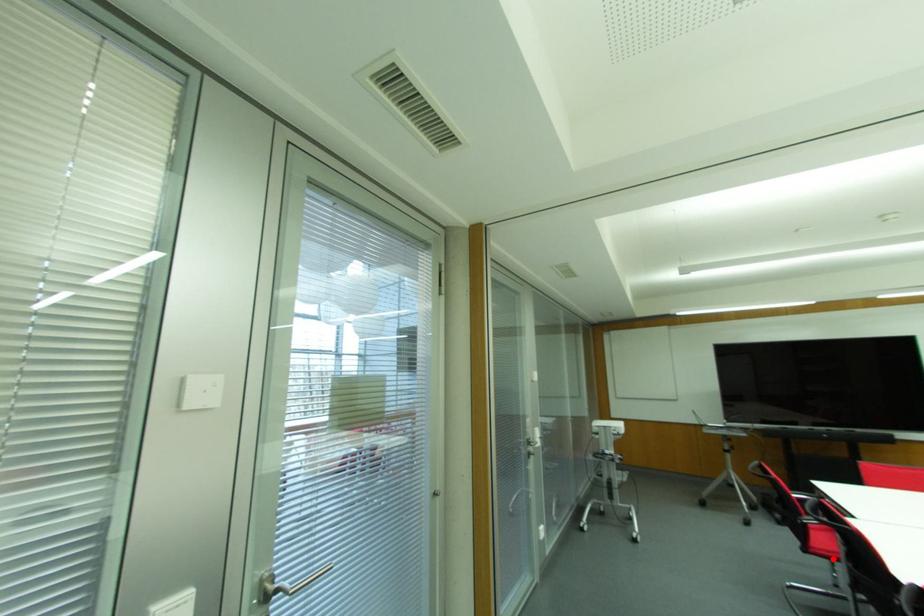
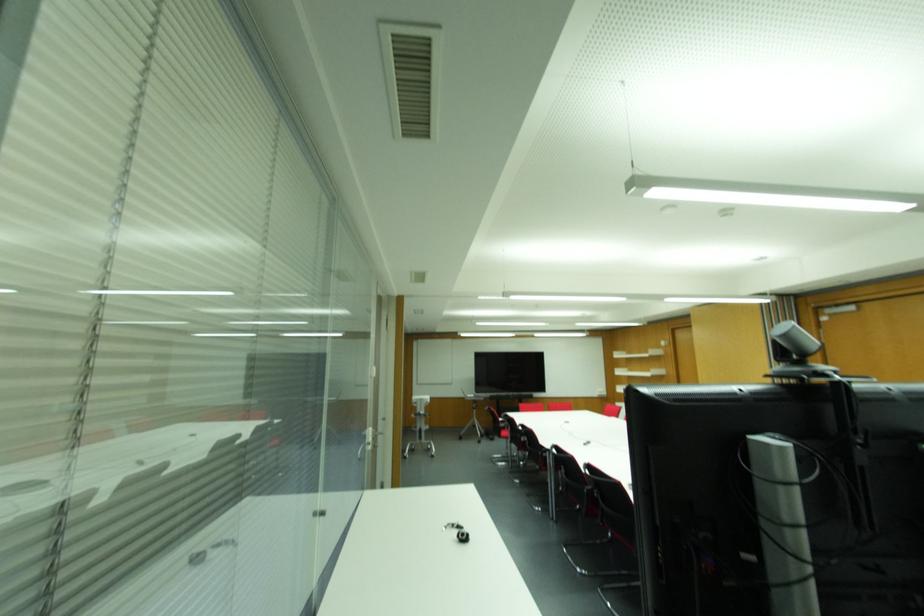
Question: I am providing you with two images of the same scene from different viewpoints. In image1, a red point is highlighted. Considering the same 3D point in image2, which of the following is correct?

Choices:
 (A) It is closer
 (B) It is farther

Answer: (A)